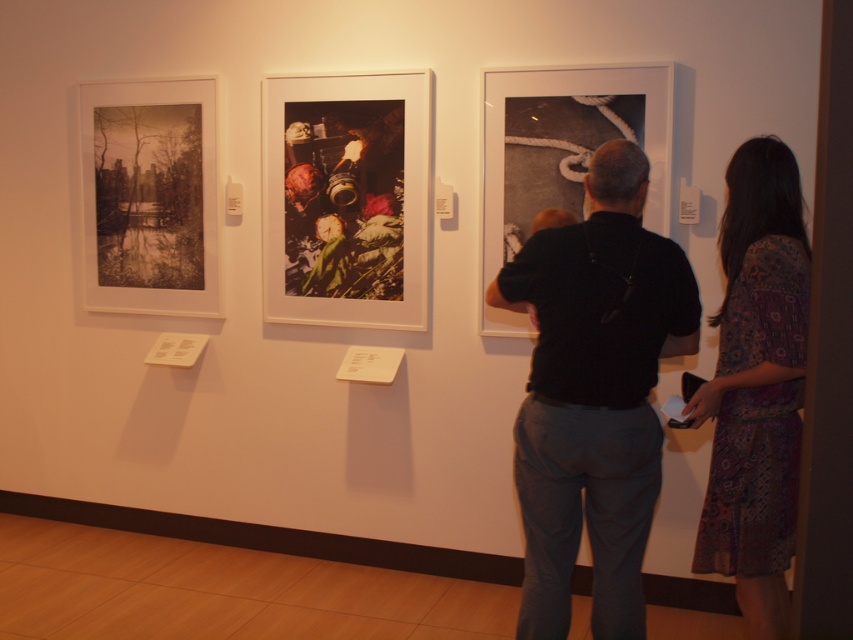
Which of these two, black matte shirt at center or shiny metallic camera at center, stands taller?

With more height is black matte shirt at center.

Is black matte shirt at center to the left of shiny metallic camera at center from the viewer's perspective?

No, black matte shirt at center is not to the left of shiny metallic camera at center.

You are a GUI agent. You are given a task and a screenshot of the screen. Output one action in this format:
    pyautogui.click(x=<x>, y=<y>)
    Task: Click on the black matte shirt at center
    Image resolution: width=853 pixels, height=640 pixels.
    Given the screenshot: What is the action you would take?
    pyautogui.click(x=595, y=396)

Can you confirm if printed cotton dress at right is positioned below sepia-toned photograph at left?

Correct, printed cotton dress at right is located below sepia-toned photograph at left.

Does printed cotton dress at right have a greater width compared to sepia-toned photograph at left?

Incorrect, printed cotton dress at right's width does not surpass sepia-toned photograph at left's.

This screenshot has height=640, width=853. What do you see at coordinates (756, 385) in the screenshot? I see `printed cotton dress at right` at bounding box center [756, 385].

At what (x,y) coordinates should I click in order to perform the action: click on printed cotton dress at right. Please return your answer as a coordinate pair (x, y). The height and width of the screenshot is (640, 853). Looking at the image, I should click on (756, 385).

From the picture: Which is more to the left, printed cotton dress at right or shiny metallic camera at center?

shiny metallic camera at center

Which is more to the right, printed cotton dress at right or shiny metallic camera at center?

Positioned to the right is printed cotton dress at right.

Does point (733, 493) come closer to viewer compared to point (349, 220)?

Yes, point (733, 493) is in front of point (349, 220).

This screenshot has width=853, height=640. I want to click on printed cotton dress at right, so click(x=756, y=385).